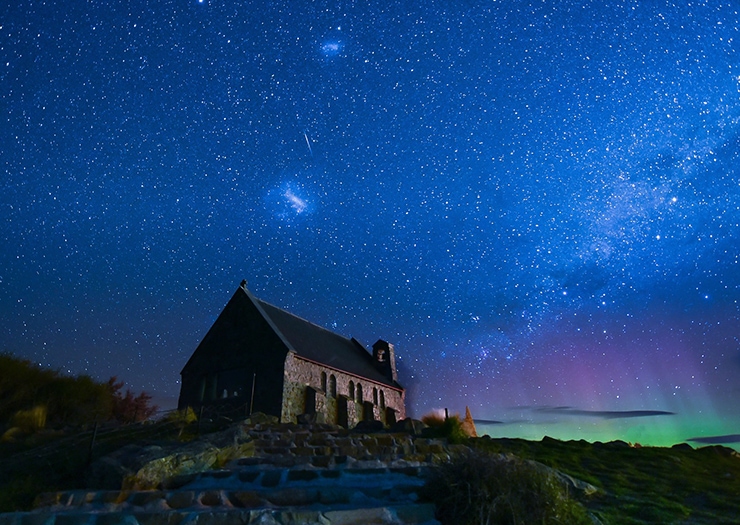
I want to click on windows, so click(x=323, y=388), click(x=334, y=386), click(x=354, y=394), click(x=362, y=394), click(x=377, y=399), click(x=383, y=399).